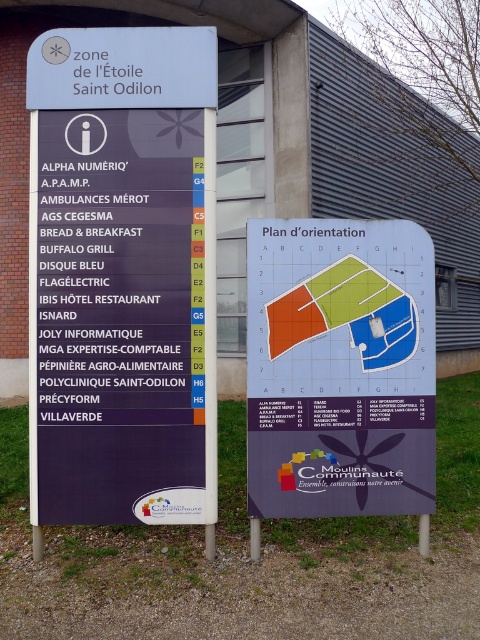
You are standing in front of the directional signboard at the entrance of zone de l. 2. You need to locate point (271,467) on the signboard. Is this point closer to the left or right side of the signboard?

The point is located at coordinates (271,467), which is closer to the right side of the signboard.